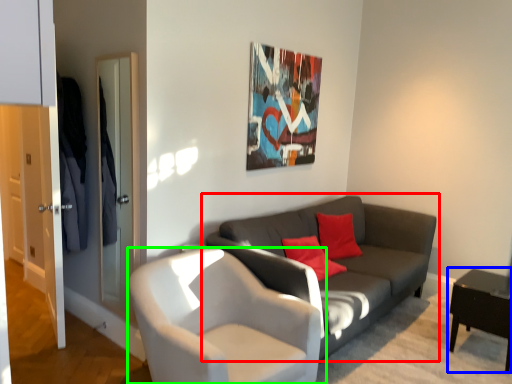
Question: Estimate the real-world distances between objects in this image. Which object is closer to studio couch (highlighted by a red box), table (highlighted by a blue box) or chair (highlighted by a green box)?

Choices:
 (A) table
 (B) chair

Answer: (B)